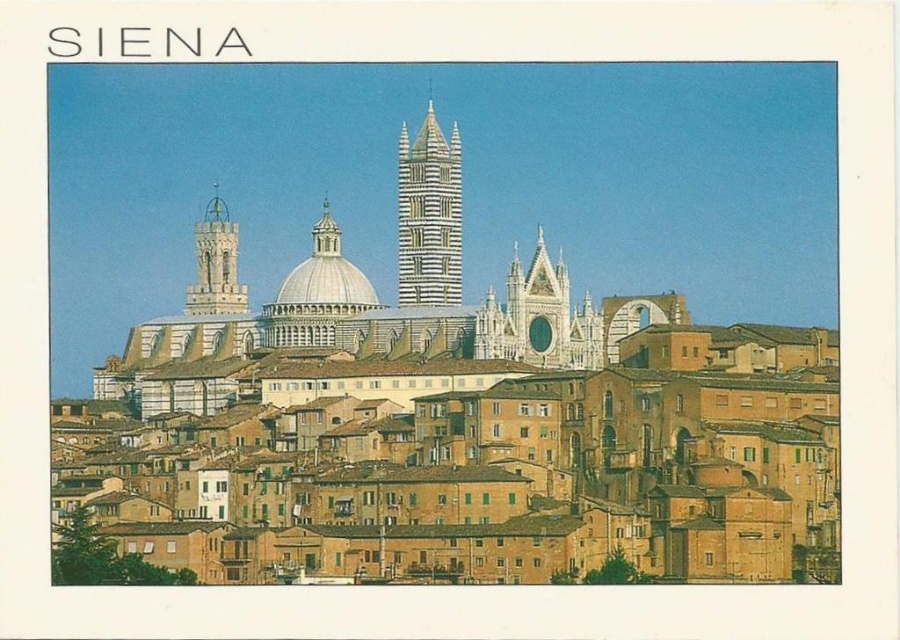
You are standing in the foreground of the Siena panorama and want to take a photo of both the white striped tower at center and the white marble dome at center. Which one should you adjust your camera focus on first to ensure both are in the frame?

You should focus on the white striped tower at center first because it is closer to you than the white marble dome at center, so adjusting focus starting from the closer object ensures both will be in the frame.

In the scene shown: You are standing at the point with coordinates [429,216] in Siena. What notable structure is located at your current position?

The white striped tower at center, which is the Torre del Mangia of the Siena Cathedral, is located at the point [429,216].

You are standing at the point closest to you in the image. Looking towards the distant point, which direction would you face? The two points are labeled as point (446, 262) and point (321, 225).

Point (321, 225) is closer to you than point (446, 262). Therefore, if you are standing at point (321, 225) and looking toward point (446, 262), you would be facing towards the direction of the point that is behind you in the scene.